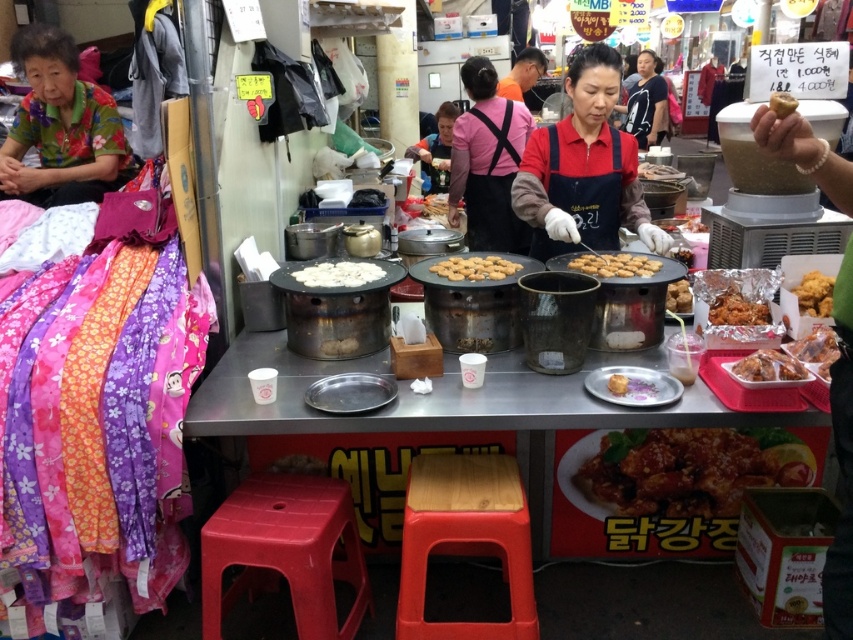
Does saucy fried chicken at center appear under shiny plastic bag at center right?

Indeed, saucy fried chicken at center is positioned under shiny plastic bag at center right.

How distant is saucy fried chicken at center from shiny plastic bag at center right?

saucy fried chicken at center and shiny plastic bag at center right are 21.89 inches apart from each other.

Identify the location of saucy fried chicken at center. The height and width of the screenshot is (640, 853). (689, 468).

Can you confirm if red apron at center is positioned to the right of shiny plastic bag at center right?

Incorrect, red apron at center is not on the right side of shiny plastic bag at center right.

Who is positioned more to the left, red apron at center or shiny plastic bag at center right?

From the viewer's perspective, red apron at center appears more on the left side.

What do you see at coordinates (583, 168) in the screenshot? This screenshot has width=853, height=640. I see `red apron at center` at bounding box center [583, 168].

You are a GUI agent. You are given a task and a screenshot of the screen. Output one action in this format:
    pyautogui.click(x=<x>, y=<y>)
    Task: Click on the red apron at center
    The height and width of the screenshot is (640, 853).
    Given the screenshot: What is the action you would take?
    pyautogui.click(x=583, y=168)

Is rubberized plastic stool at lower left bigger than matte black shirt at upper center?

Incorrect, rubberized plastic stool at lower left is not larger than matte black shirt at upper center.

Does rubberized plastic stool at lower left appear over matte black shirt at upper center?

No.

This screenshot has height=640, width=853. I want to click on rubberized plastic stool at lower left, so click(x=285, y=552).

Identify the location of rubberized plastic stool at lower left. (285, 552).